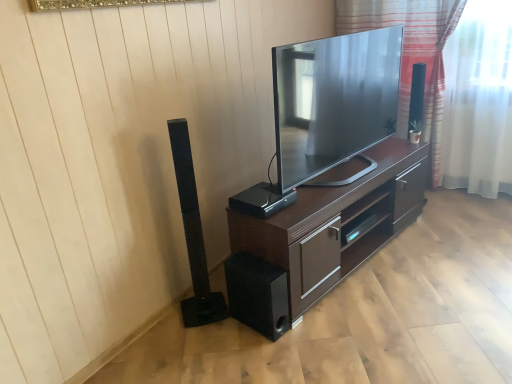
Identify the location of vacant space in front of dark wood cabinet at center. This screenshot has height=384, width=512. (376, 324).